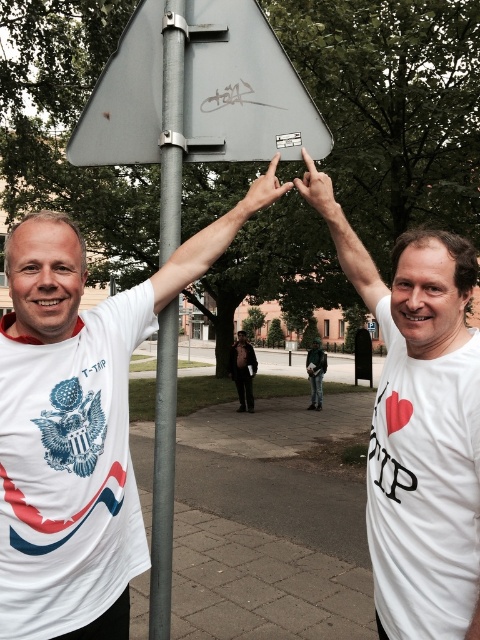
Question: Can you confirm if white matte t-shirt at upper left is positioned to the right of metallic sign at upper center?

Choices:
 (A) yes
 (B) no

Answer: (B)

Question: Is matte black hand at center to the left of dark gray suit at center from the viewer's perspective?

Choices:
 (A) yes
 (B) no

Answer: (B)

Question: Does gray metallic pole at center appear on the right side of dark gray suit at center?

Choices:
 (A) yes
 (B) no

Answer: (B)

Question: Which point is closer to the camera?

Choices:
 (A) (162, 492)
 (B) (291, 104)
 (C) (257, 200)

Answer: (A)

Question: Which of these objects is positioned closest to the matte gray sign at center?

Choices:
 (A) green fabric jacket at center
 (B) white matte t-shirt at upper center

Answer: (B)

Question: Which is nearer to the matte black hand at center?

Choices:
 (A) white matte t-shirt at upper left
 (B) metallic sign at upper center
 (C) dark gray suit at center

Answer: (B)